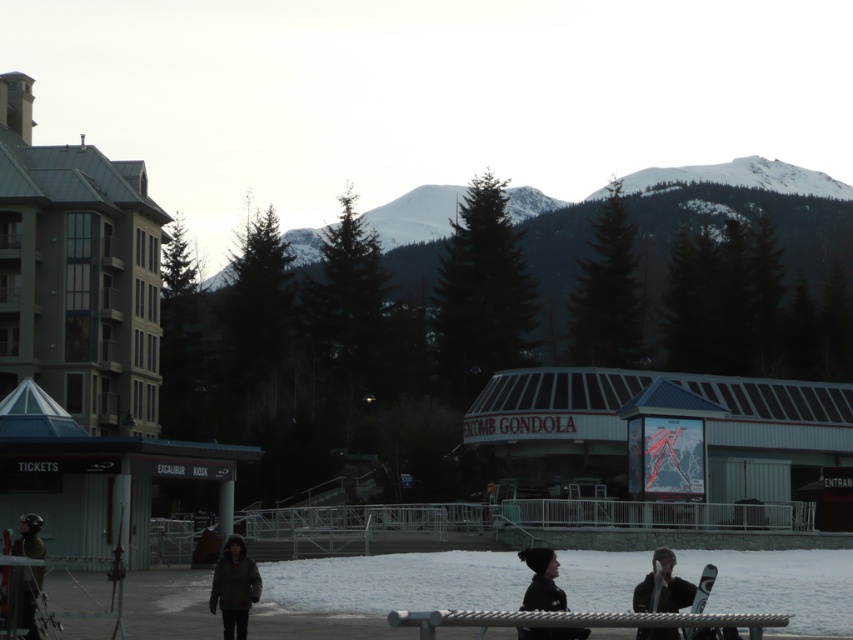
Between silver metallic bench at lower center and green fabric jacket at lower left, which one appears on the right side from the viewer's perspective?

silver metallic bench at lower center is more to the right.

Does silver metallic bench at lower center come in front of green fabric jacket at lower left?

Yes, silver metallic bench at lower center is in front of green fabric jacket at lower left.

Is point (676, 612) positioned after point (35, 525)?

No.

Where is `silver metallic bench at lower center`? This screenshot has width=853, height=640. silver metallic bench at lower center is located at coordinates (578, 620).

Can you confirm if silver metallic bench at lower center is taller than black matte jacket at lower center?

No.

Can you confirm if silver metallic bench at lower center is smaller than black matte jacket at lower center?

Correct, silver metallic bench at lower center occupies less space than black matte jacket at lower center.

Does point (634, 616) come in front of point (546, 570)?

That is True.

You are a GUI agent. You are given a task and a screenshot of the screen. Output one action in this format:
    pyautogui.click(x=<x>, y=<y>)
    Task: Click on the silver metallic bench at lower center
    This screenshot has height=640, width=853.
    Given the screenshot: What is the action you would take?
    pyautogui.click(x=578, y=620)

I want to click on white corrugated metal ski resort at center, so click(x=669, y=416).

Is point (808, 412) closer to viewer compared to point (10, 616)?

No.

Which is in front, point (791, 474) or point (33, 568)?

Point (33, 568) is in front.

At what (x,y) coordinates should I click in order to perform the action: click on white corrugated metal ski resort at center. Please return your answer as a coordinate pair (x, y). Looking at the image, I should click on (669, 416).